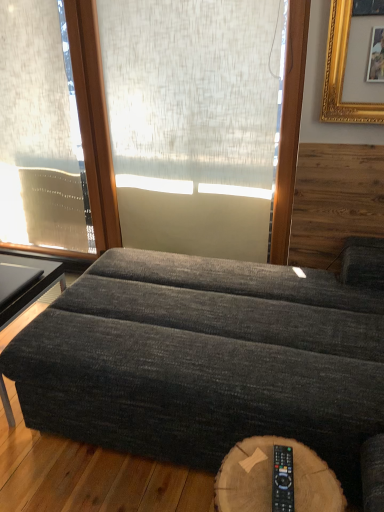
Question: Is white textured screen at center bigger or smaller than wooden log table at lower center?

Choices:
 (A) small
 (B) big

Answer: (B)

Question: From a real-world perspective, is white textured screen at center physically located above or below wooden log table at lower center?

Choices:
 (A) above
 (B) below

Answer: (A)

Question: Which object is positioned farthest from the wooden log table at lower center?

Choices:
 (A) dark gray fabric ottoman at center
 (B) white textured screen at center
 (C) dark gray fabric ottoman at lower left
 (D) black plastic remote at lower right
 (E) translucent beige curtain at left

Answer: (E)

Question: Which object is positioned closest to the black plastic remote at lower right?

Choices:
 (A) dark gray fabric ottoman at lower left
 (B) translucent beige curtain at left
 (C) wooden log table at lower center
 (D) dark gray fabric ottoman at center
 (E) white textured screen at center

Answer: (C)